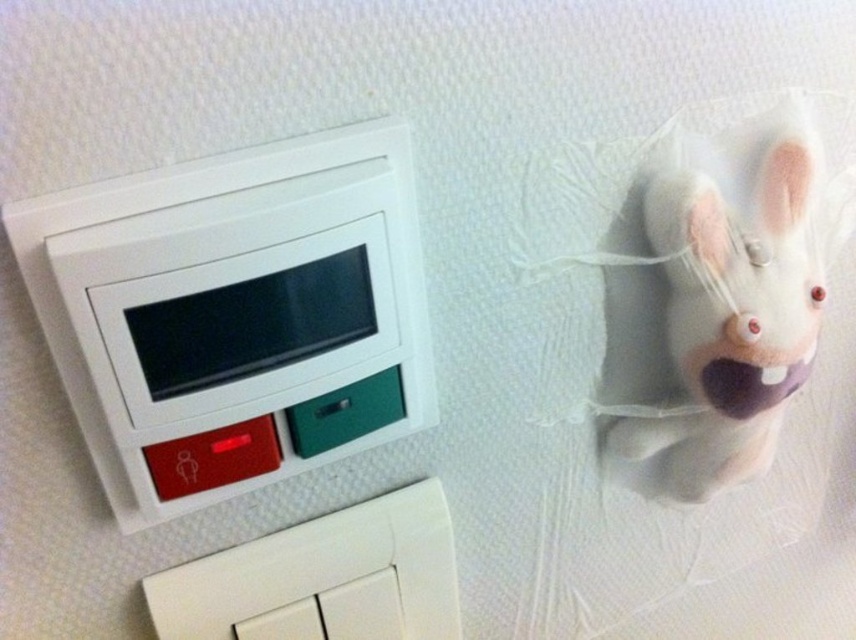
Based on the photo, can you confirm if white felt rabbit at upper right is positioned below white plastic switch at lower left?

Incorrect, white felt rabbit at upper right is not positioned below white plastic switch at lower left.

I want to click on white felt rabbit at upper right, so click(x=736, y=292).

Is point (700, 364) more distant than point (271, 609)?

Yes.

Locate an element on the screen. The height and width of the screenshot is (640, 856). white felt rabbit at upper right is located at coordinates (736, 292).

Can you confirm if white plastic light switch at upper left is positioned above white felt rabbit at upper right?

Incorrect, white plastic light switch at upper left is not positioned above white felt rabbit at upper right.

From the picture: Can you confirm if white plastic light switch at upper left is positioned below white felt rabbit at upper right?

Result: Yes, white plastic light switch at upper left is below white felt rabbit at upper right.

Which is in front, point (385, 157) or point (764, 413)?

Point (385, 157) is more forward.

Where is `white plastic light switch at upper left`? white plastic light switch at upper left is located at coordinates (235, 314).

Is white plastic light switch at upper left bigger than white plastic switch at lower left?

Correct, white plastic light switch at upper left is larger in size than white plastic switch at lower left.

Can you confirm if white plastic light switch at upper left is positioned below white plastic switch at lower left?

Actually, white plastic light switch at upper left is above white plastic switch at lower left.

Which is in front, point (301, 428) or point (354, 592)?

Positioned in front is point (301, 428).

The image size is (856, 640). In order to click on white plastic light switch at upper left in this screenshot , I will do `click(235, 314)`.